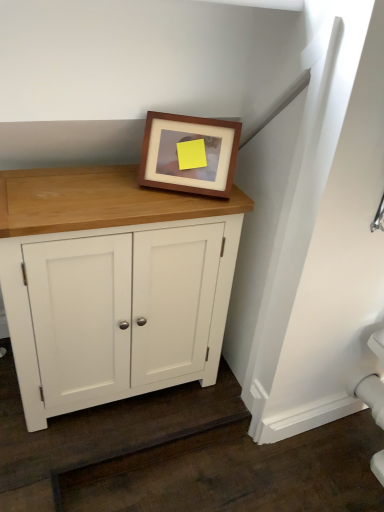
Question: From the image's perspective, is brown wooden picture frame at upper center located beneath white wood cupboard at center?

Choices:
 (A) yes
 (B) no

Answer: (B)

Question: Does brown wooden picture frame at upper center have a greater height compared to white wood cupboard at center?

Choices:
 (A) yes
 (B) no

Answer: (B)

Question: Is brown wooden picture frame at upper center wider than white wood cupboard at center?

Choices:
 (A) no
 (B) yes

Answer: (A)

Question: Is brown wooden picture frame at upper center aimed at white wood cupboard at center?

Choices:
 (A) yes
 (B) no

Answer: (B)

Question: Can you confirm if brown wooden picture frame at upper center is positioned to the right of white wood cupboard at center?

Choices:
 (A) no
 (B) yes

Answer: (B)

Question: Can you confirm if brown wooden picture frame at upper center is bigger than white wood cupboard at center?

Choices:
 (A) no
 (B) yes

Answer: (A)

Question: Does white wood cupboard at center appear on the right side of brown wooden picture frame at upper center?

Choices:
 (A) no
 (B) yes

Answer: (A)

Question: Does white wood cupboard at center have a lesser width compared to brown wooden picture frame at upper center?

Choices:
 (A) no
 (B) yes

Answer: (A)

Question: Is the depth of white wood cupboard at center less than that of brown wooden picture frame at upper center?

Choices:
 (A) no
 (B) yes

Answer: (B)

Question: Can you confirm if white wood cupboard at center is wider than brown wooden picture frame at upper center?

Choices:
 (A) no
 (B) yes

Answer: (B)

Question: From a real-world perspective, is white wood cupboard at center positioned over brown wooden picture frame at upper center based on gravity?

Choices:
 (A) yes
 (B) no

Answer: (B)

Question: Is white wood cupboard at center shorter than brown wooden picture frame at upper center?

Choices:
 (A) yes
 (B) no

Answer: (B)

Question: In terms of height, does brown wooden picture frame at upper center look taller or shorter compared to white wood cupboard at center?

Choices:
 (A) short
 (B) tall

Answer: (A)